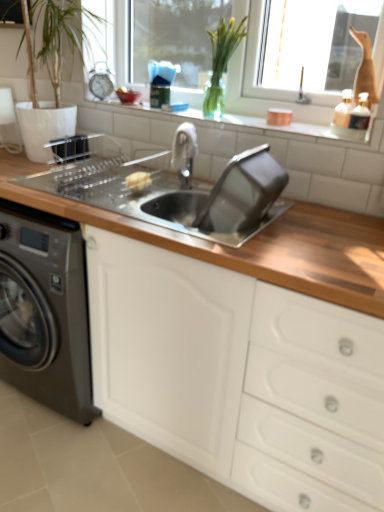
Locate an element on the screen. This screenshot has height=512, width=384. blank space situated above white glossy tile at upper center (from a real-world perspective) is located at coordinates (211, 114).